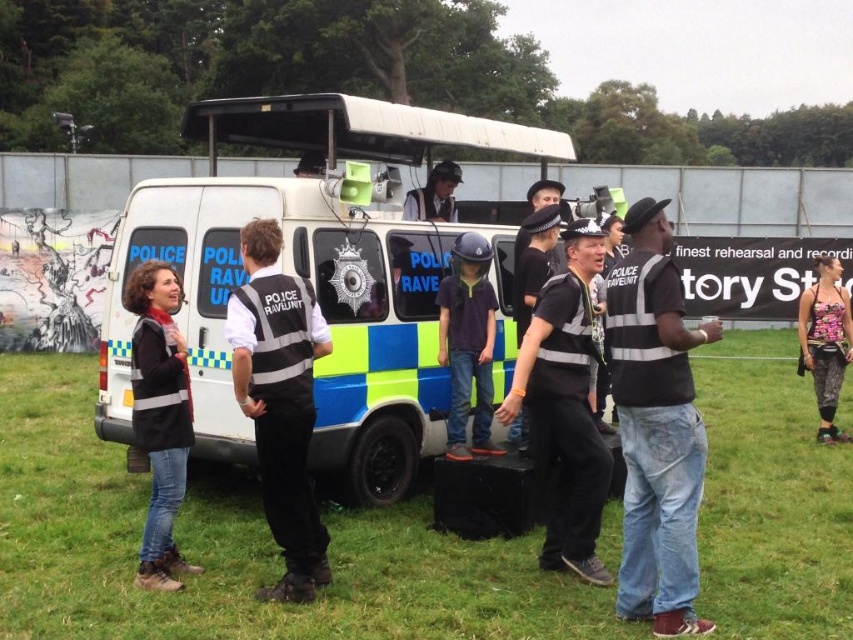
You are a photographer trying to capture a clear shot of the black matte jacket at left and the dark blue uniform at center. Since you want to ensure both are visible, which object should you focus on first to account for their sizes?

The black matte jacket at left occupies less space than dark blue uniform at center, so you should focus on the dark blue uniform at center first to ensure its details are captured clearly before adjusting for the smaller black matte jacket at left.

You are a photographer trying to capture a clear shot of the black matte jacket at left and the dark blue uniform at center. Based on their positions, which one is lower in the frame?

The black matte jacket at left is below the dark blue uniform at center, so it is lower in the frame.